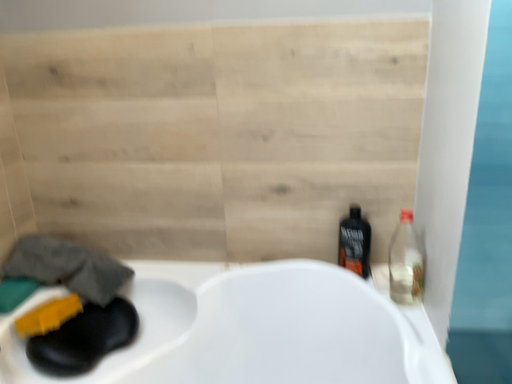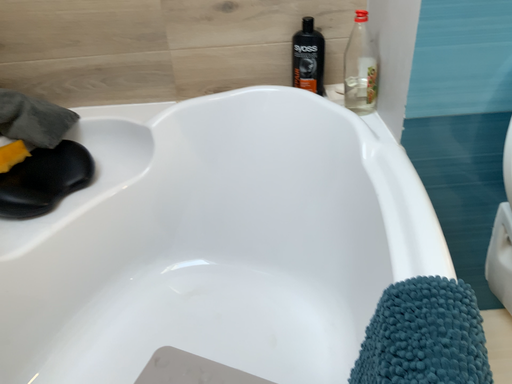
Question: How did the camera likely rotate when shooting the video?

Choices:
 (A) rotated right
 (B) rotated left

Answer: (A)